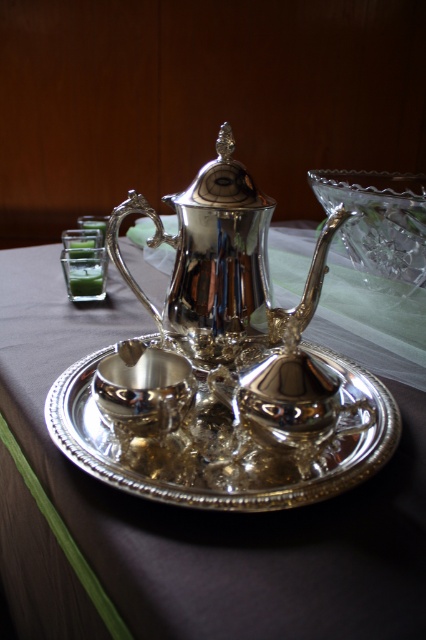
Question: Observing the image, what is the correct spatial positioning of polished silver teapot at center in reference to polished silver sugar bowl at center?

Choices:
 (A) left
 (B) right

Answer: (B)

Question: Observing the image, what is the correct spatial positioning of polished silver saucer at center in reference to polished silver teapot at center?

Choices:
 (A) above
 (B) below

Answer: (B)

Question: Which object appears closest to the camera in this image?

Choices:
 (A) polished silver teapot at center
 (B) polished silver saucer at center
 (C) polished silver sugar bowl at center

Answer: (B)

Question: Which point appears farthest from the camera in this image?

Choices:
 (A) (123, 353)
 (B) (227, 209)
 (C) (351, 371)

Answer: (C)

Question: Estimate the real-world distances between objects in this image. Which object is closer to the polished silver teapot at center?

Choices:
 (A) polished silver sugar bowl at center
 (B) shiny silver tray at center

Answer: (A)

Question: Does polished silver teapot at center appear on the right side of polished silver sugar bowl at center?

Choices:
 (A) yes
 (B) no

Answer: (A)